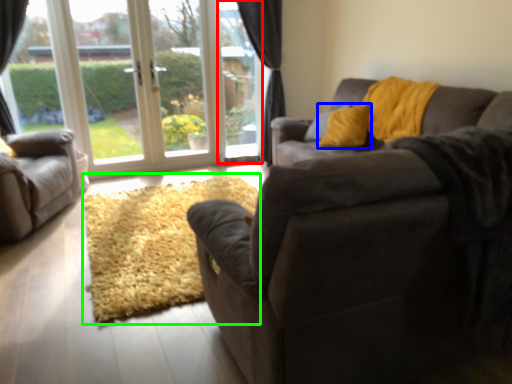
Question: Estimate the real-world distances between objects in this image. Which object is farther from window screen (highlighted by a red box), throw pillow (highlighted by a blue box) or doormat (highlighted by a green box)?

Choices:
 (A) throw pillow
 (B) doormat

Answer: (B)